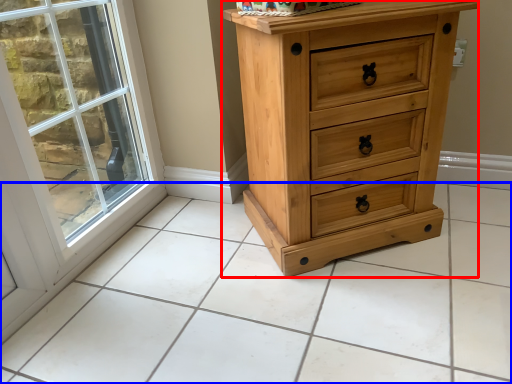
Question: Which object is closer to the camera taking this photo, chest of drawers (highlighted by a red box) or tile (highlighted by a blue box)?

Choices:
 (A) chest of drawers
 (B) tile

Answer: (B)